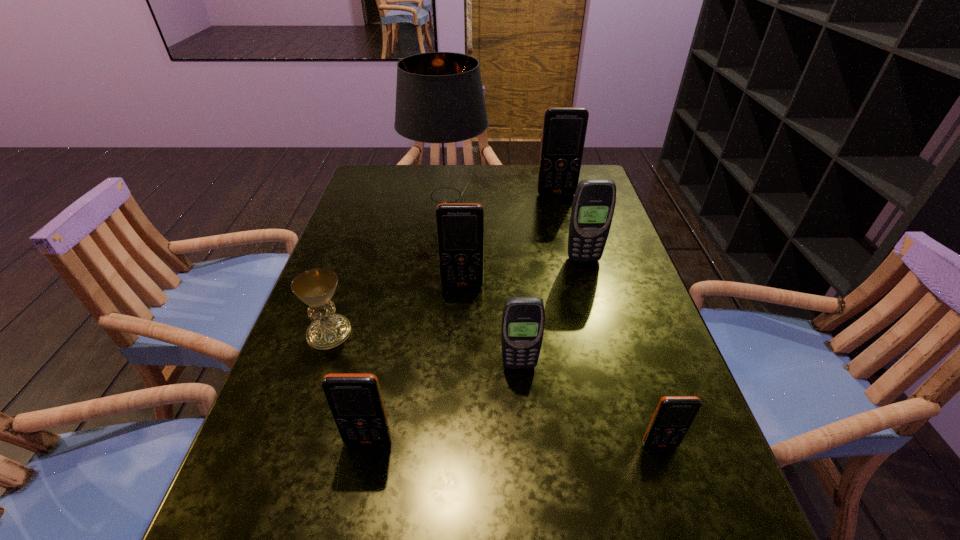
Where is `gray lampshade`? The width and height of the screenshot is (960, 540). gray lampshade is located at coordinates (440, 106).

Identify the location of lampshade. (440, 106).

Locate an element on the screen. The width and height of the screenshot is (960, 540). the biggest orange cellular telephone is located at coordinates 564,128.

The image size is (960, 540). I want to click on the tallest cellular telephone, so click(x=564, y=128).

The height and width of the screenshot is (540, 960). I want to click on the fifth cellular telephone from right to left, so click(460, 226).

At what (x,y) coordinates should I click in order to perform the action: click on the second farthest orange cellular telephone. Please return your answer as a coordinate pair (x, y). Looking at the image, I should click on (460, 226).

Find the location of a particular element. The height and width of the screenshot is (540, 960). the right gray cellular telephone is located at coordinates (593, 206).

Locate an element on the screen. This screenshot has height=540, width=960. the farther gray cellular telephone is located at coordinates (593, 206).

The width and height of the screenshot is (960, 540). What are the coordinates of `the third cellular telephone from left to right` in the screenshot? It's located at (523, 319).

Where is `the nearer gray cellular telephone`? Image resolution: width=960 pixels, height=540 pixels. the nearer gray cellular telephone is located at coordinates (523, 319).